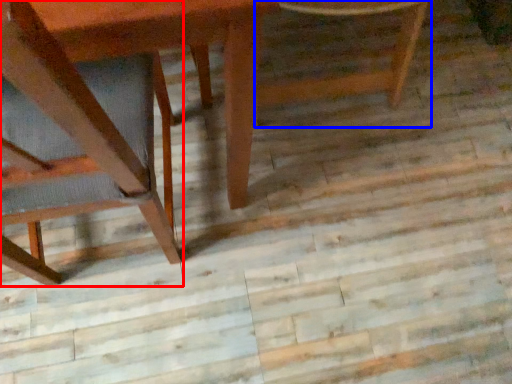
Question: Among these objects, which one is farthest to the camera, chair (highlighted by a red box) or chair (highlighted by a blue box)?

Choices:
 (A) chair
 (B) chair

Answer: (B)